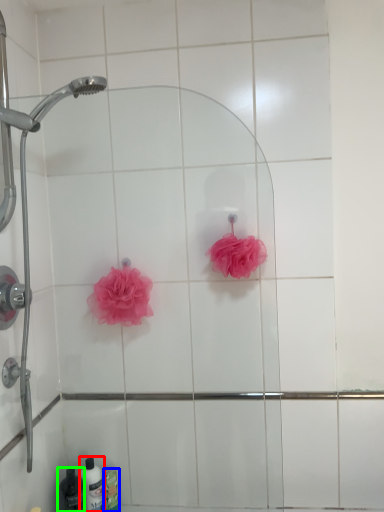
Question: Estimate the real-world distances between objects in this image. Which object is closer to toiletry (highlighted by a red box), toiletry (highlighted by a blue box) or toiletry (highlighted by a green box)?

Choices:
 (A) toiletry
 (B) toiletry

Answer: (A)